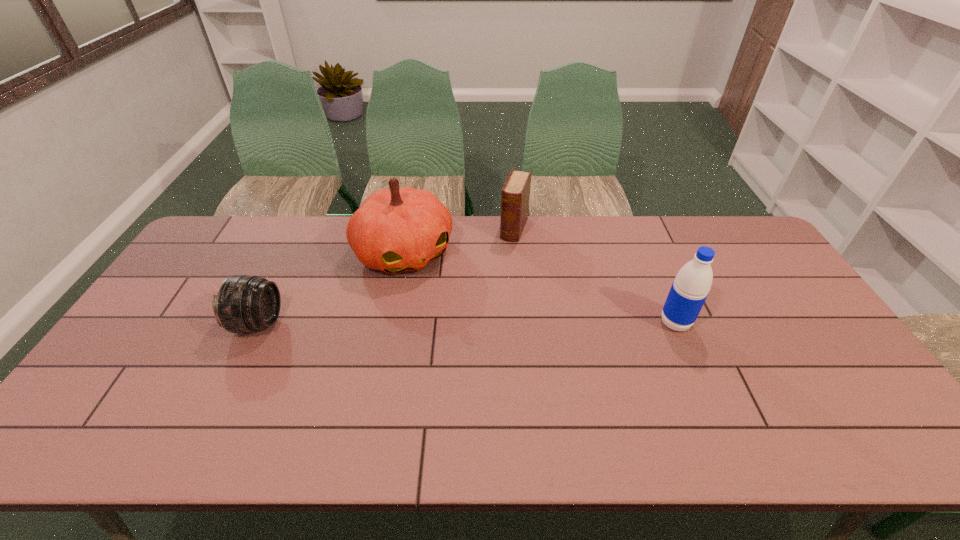
Find the location of a particular element. Image resolution: width=960 pixels, height=540 pixels. the leftmost object is located at coordinates (244, 303).

The image size is (960, 540). What are the coordinates of `telephoto lens` in the screenshot? It's located at (244, 303).

I want to click on water bottle, so click(x=691, y=286).

Locate an element on the screen. the third object from left to right is located at coordinates (515, 197).

You are a GUI agent. You are given a task and a screenshot of the screen. Output one action in this format:
    pyautogui.click(x=<x>, y=<y>)
    Task: Click on the third tallest object
    This screenshot has width=960, height=540.
    Given the screenshot: What is the action you would take?
    pyautogui.click(x=515, y=197)

Where is `pumpkin`? pumpkin is located at coordinates (395, 230).

Identify the location of vacant space located at the front element of the shortest object. This screenshot has width=960, height=540. (325, 323).

At what (x,y) coordinates should I click in order to perform the action: click on free space located on the front of the rightmost object. Please return your answer as a coordinate pair (x, y). Looking at the image, I should click on (697, 375).

Identify the location of vacant space located on the spine side of the third tallest object. Image resolution: width=960 pixels, height=540 pixels. (477, 325).

The height and width of the screenshot is (540, 960). Find the location of `free space located 0.380m on the spine side of the third tallest object`. free space located 0.380m on the spine side of the third tallest object is located at coordinates (478, 323).